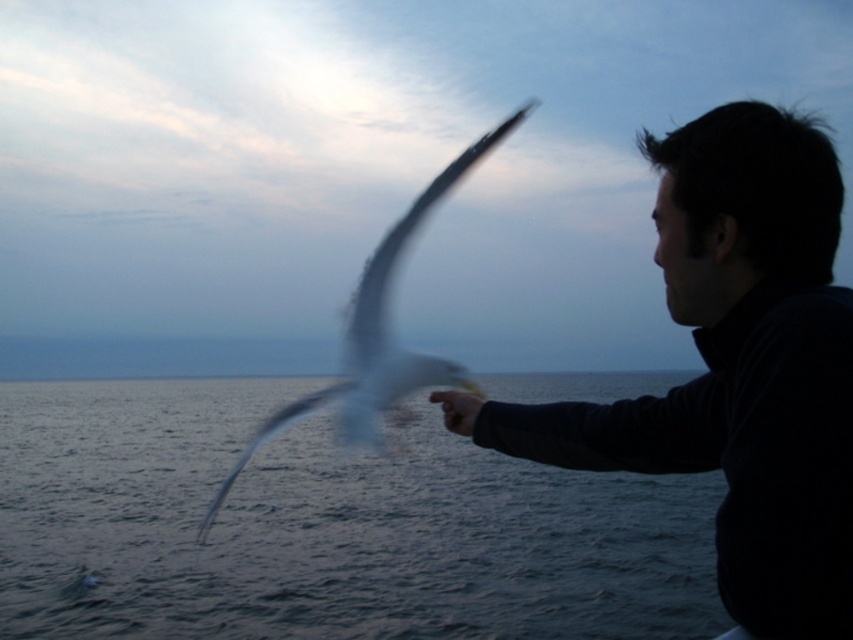
Question: Which is farther from the black matte fish at right?

Choices:
 (A) clear water at lower left
 (B) white feathered bird at center

Answer: (A)

Question: Does black matte fish at right appear on the left side of white feathered bird at center?

Choices:
 (A) no
 (B) yes

Answer: (B)

Question: Which object is positioned farthest from the clear water at lower left?

Choices:
 (A) white feathered bird at center
 (B) black matte fish at right

Answer: (B)

Question: Is clear water at lower left to the right of white feathered bird at center from the viewer's perspective?

Choices:
 (A) no
 (B) yes

Answer: (A)

Question: Which is nearer to the clear water at lower left?

Choices:
 (A) white feathered bird at center
 (B) black matte fish at right

Answer: (A)

Question: Is black matte fish at right to the right of white feathered bird at center from the viewer's perspective?

Choices:
 (A) no
 (B) yes

Answer: (A)